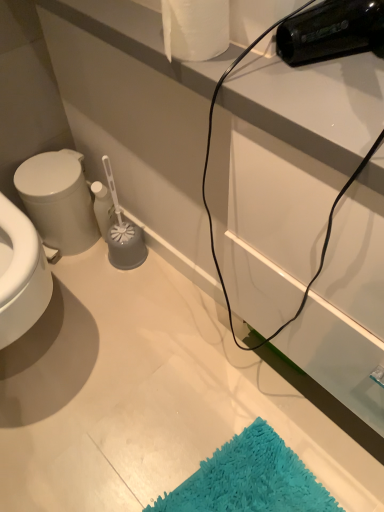
Question: Considering their positions, is white matte toilet paper at upper center located in front of or behind white glossy bidet at left?

Choices:
 (A) behind
 (B) front

Answer: (B)

Question: Would you say white matte toilet paper at upper center is to the left or to the right of white glossy bidet at left in the picture?

Choices:
 (A) left
 (B) right

Answer: (B)

Question: From their relative heights in the image, would you say white matte toilet paper at upper center is taller or shorter than white glossy bidet at left?

Choices:
 (A) short
 (B) tall

Answer: (A)

Question: Considering the relative positions of white glossy bidet at left and white matte toilet paper at upper center in the image provided, is white glossy bidet at left to the left or to the right of white matte toilet paper at upper center?

Choices:
 (A) left
 (B) right

Answer: (A)

Question: From a real-world perspective, is white glossy bidet at left above or below white matte toilet paper at upper center?

Choices:
 (A) above
 (B) below

Answer: (B)

Question: Considering the positions of white glossy bidet at left and white matte toilet paper at upper center in the image, is white glossy bidet at left wider or thinner than white matte toilet paper at upper center?

Choices:
 (A) thin
 (B) wide

Answer: (B)

Question: From the image's perspective, is white glossy bidet at left located above or below white matte toilet paper at upper center?

Choices:
 (A) below
 (B) above

Answer: (A)